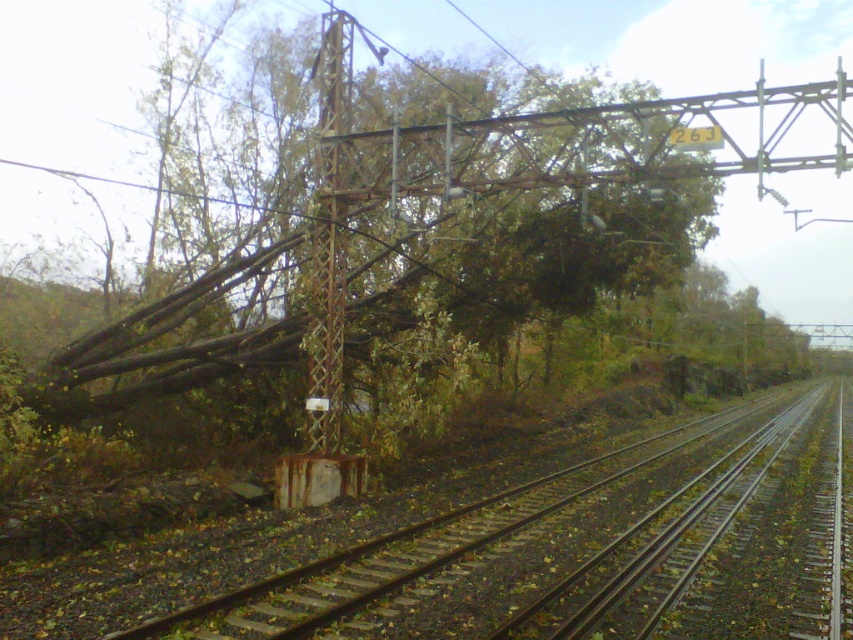
You are a railway inspector checking the scene after a storm. You notice the brown wood tree at center and the rusty metal pole at center. Which object is wider?

The brown wood tree at center is wider than the rusty metal pole at center.

You are a railway inspector checking the scene after a storm. You notice the rusty metal train track at left and the rusty metal pole at center. Which object is larger in size?

The rusty metal train track at left is bigger than the rusty metal pole at center.

Based on the photo, you are a railway inspector checking the safety of the tracks. You see the brown wood tree at center and the rusty metal train track at left. According to safety regulations, the minimum safe distance between a fallen tree and the tracks must be at least 30 feet to prevent electrical hazards. Is the current distance compliant with the regulations?

The distance between the brown wood tree at center and the rusty metal train track at left is 26.16 feet, which is less than the required 30 feet. Therefore, it does not comply with safety regulations and poses an electrical hazard.